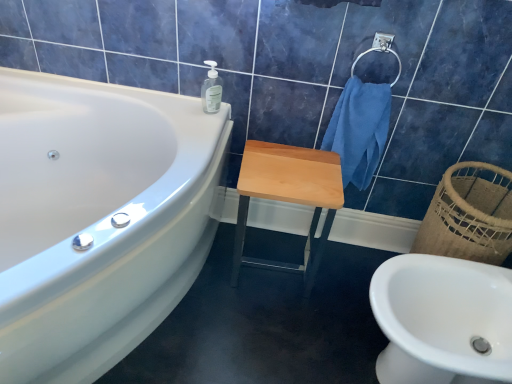
Question: Can you confirm if transparent plastic soap dispenser at upper center is taller than satin silver towel bar at upper right?

Choices:
 (A) no
 (B) yes

Answer: (A)

Question: Would you say transparent plastic soap dispenser at upper center is outside satin silver towel bar at upper right?

Choices:
 (A) no
 (B) yes

Answer: (B)

Question: From a real-world perspective, is transparent plastic soap dispenser at upper center under satin silver towel bar at upper right?

Choices:
 (A) yes
 (B) no

Answer: (A)

Question: Is satin silver towel bar at upper right completely or partially inside transparent plastic soap dispenser at upper center?

Choices:
 (A) no
 (B) yes

Answer: (A)

Question: Does transparent plastic soap dispenser at upper center appear on the right side of satin silver towel bar at upper right?

Choices:
 (A) no
 (B) yes

Answer: (A)

Question: Is transparent plastic soap dispenser at upper center placed right next to satin silver towel bar at upper right?

Choices:
 (A) yes
 (B) no

Answer: (B)

Question: Is light wood/matte stool at center further to the viewer compared to white glossy bathtub at upper left?

Choices:
 (A) no
 (B) yes

Answer: (B)

Question: Is white glossy bathtub at upper left a part of light wood/matte stool at center?

Choices:
 (A) yes
 (B) no

Answer: (B)

Question: Can you confirm if light wood/matte stool at center is thinner than white glossy bathtub at upper left?

Choices:
 (A) yes
 (B) no

Answer: (A)

Question: From a real-world perspective, is light wood/matte stool at center on top of white glossy bathtub at upper left?

Choices:
 (A) no
 (B) yes

Answer: (A)

Question: Is light wood/matte stool at center positioned with its back to white glossy bathtub at upper left?

Choices:
 (A) yes
 (B) no

Answer: (B)

Question: Can you confirm if light wood/matte stool at center is wider than white glossy bathtub at upper left?

Choices:
 (A) yes
 (B) no

Answer: (B)

Question: Is transparent plastic soap dispenser at upper center far away from light wood/matte stool at center?

Choices:
 (A) no
 (B) yes

Answer: (A)